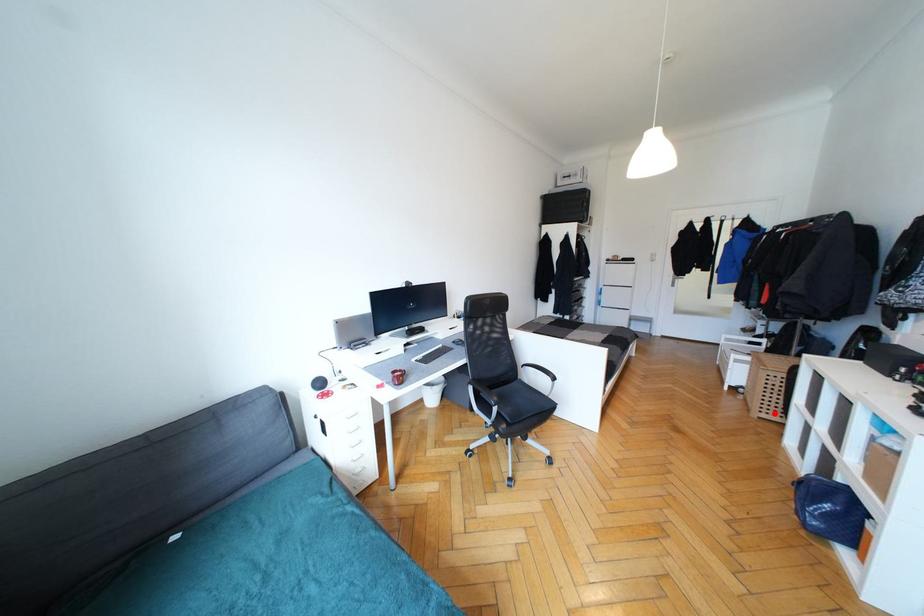
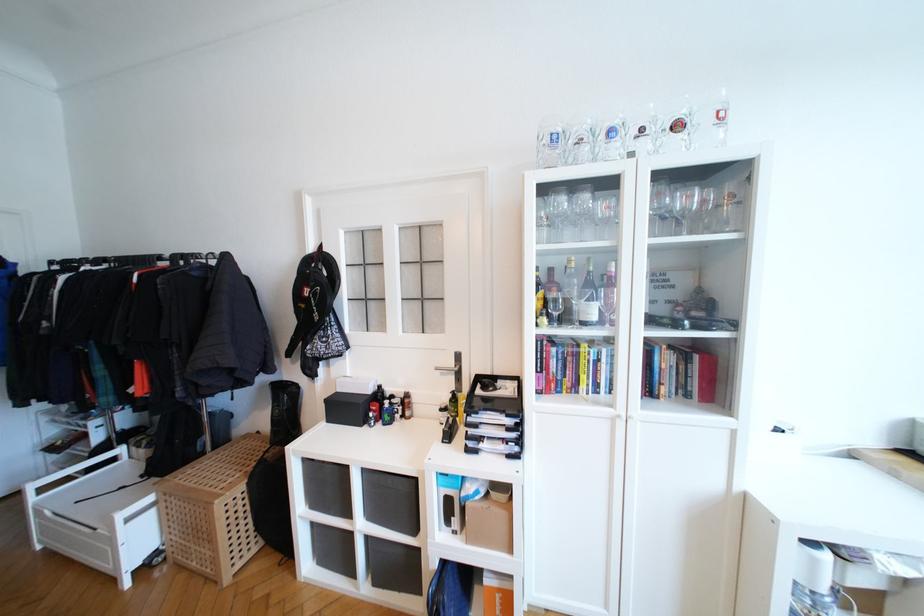
Question: A red point is marked in image1. In image2, is the corresponding 3D point closer to the camera or farther? Reply with the corresponding letter.

Choices:
 (A) The corresponding 3D point is closer.
 (B) The corresponding 3D point is farther.

Answer: (A)